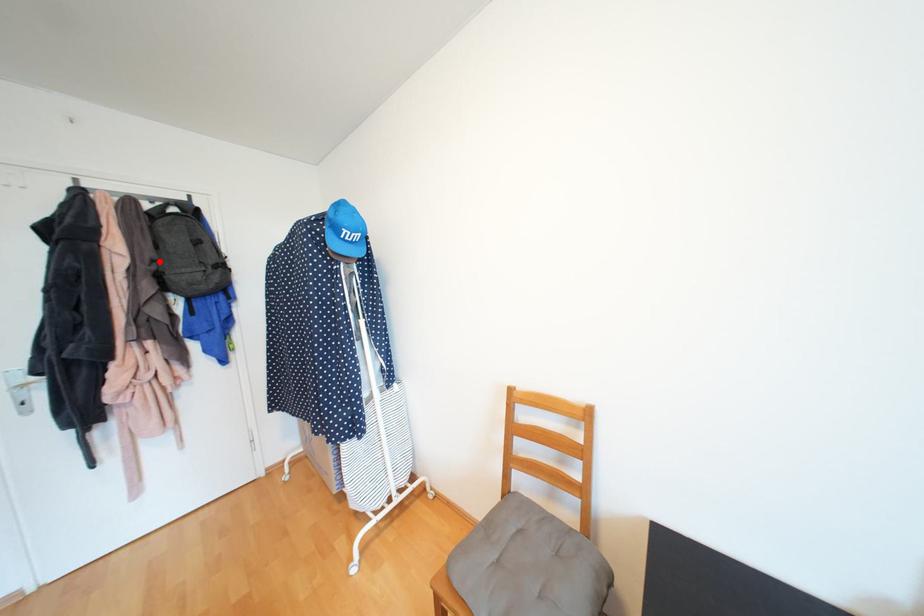
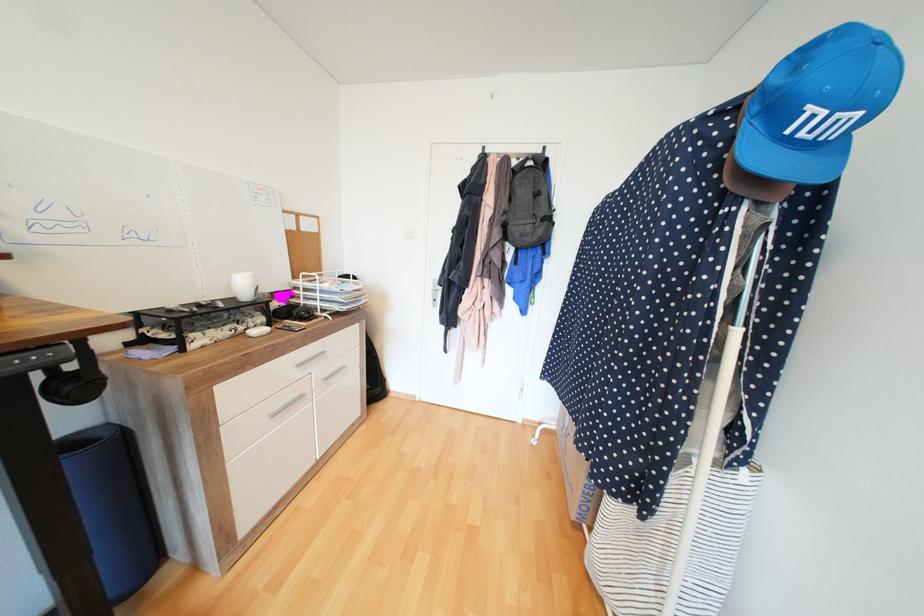
Locate, in the second image, the point that corresponds to the highlighted location in the first image.

(511, 213)